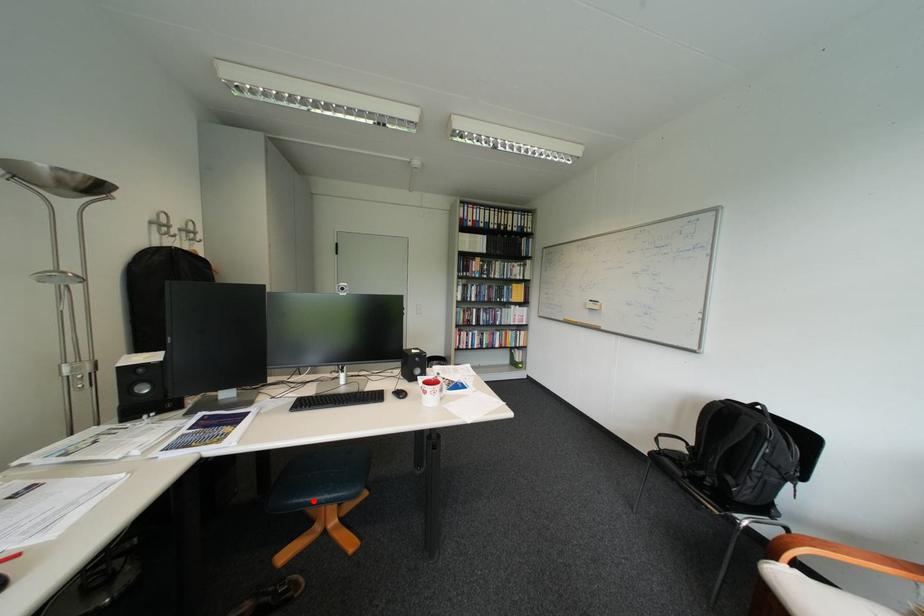
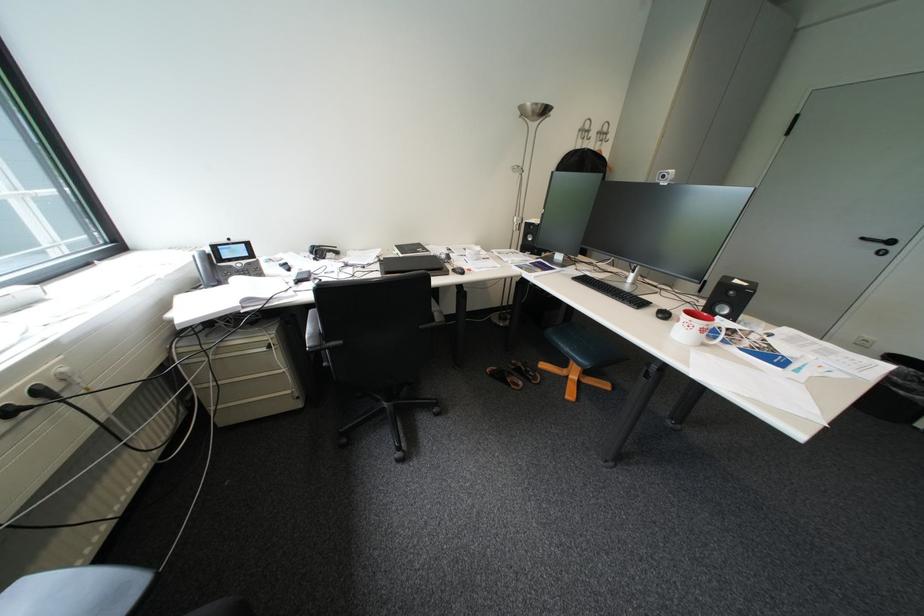
Question: I am providing you with two images of the same scene from different viewpoints. A red point is marked on the first image. Can you still see the location of the red point in image 2?

Choices:
 (A) Yes
 (B) No

Answer: (A)